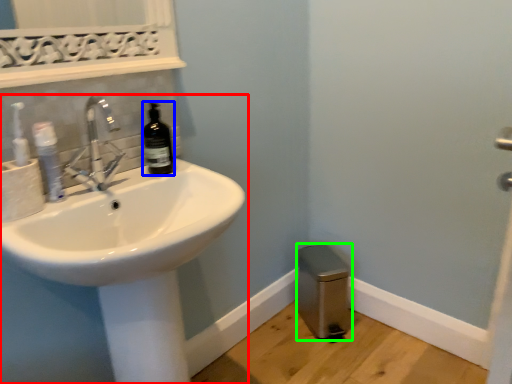
Question: Which object is the farthest from sink (highlighted by a red box)? Choose among these: bottle (highlighted by a blue box) or bidet (highlighted by a green box).

Choices:
 (A) bottle
 (B) bidet

Answer: (B)